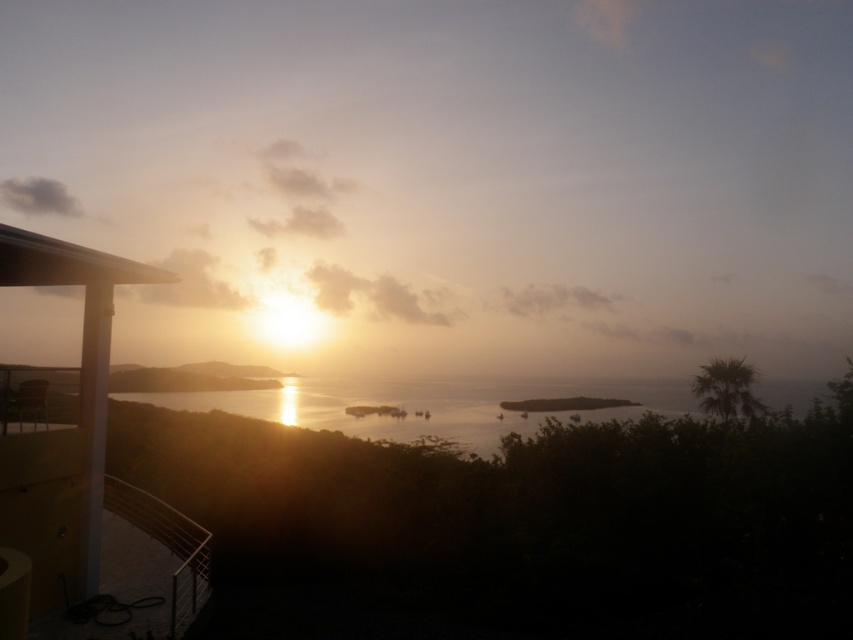
Question: Which object appears closest to the camera in this image?

Choices:
 (A) matte yellow balcony at left
 (B) silvery reflective water at center

Answer: (A)

Question: Where is matte yellow balcony at left located in relation to silvery reflective water at center in the image?

Choices:
 (A) below
 (B) above

Answer: (B)

Question: Can you confirm if matte yellow balcony at left is positioned to the left of silvery reflective water at center?

Choices:
 (A) no
 (B) yes

Answer: (B)

Question: Which point is closer to the camera?

Choices:
 (A) silvery reflective water at center
 (B) matte yellow balcony at left

Answer: (B)

Question: Is matte yellow balcony at left closer to the viewer compared to silvery reflective water at center?

Choices:
 (A) no
 (B) yes

Answer: (B)